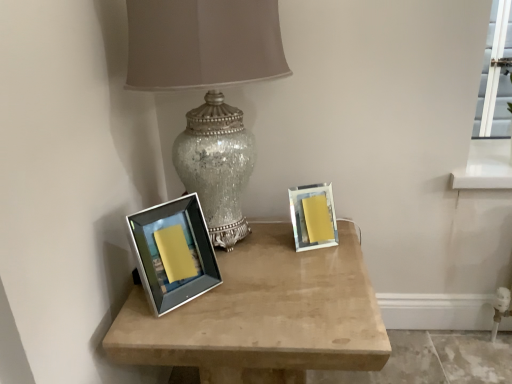
Question: Can we say matte silver picture frame at right, the first picture frame viewed from the back, lies outside crackle glass lamp at center?

Choices:
 (A) yes
 (B) no

Answer: (A)

Question: From a real-world perspective, is matte silver picture frame at right, the first picture frame viewed from the back, positioned under crackle glass lamp at center based on gravity?

Choices:
 (A) no
 (B) yes

Answer: (B)

Question: Does matte silver picture frame at right, which appears as the 2th picture frame when viewed from the left, have a greater width compared to crackle glass lamp at center?

Choices:
 (A) yes
 (B) no

Answer: (B)

Question: Is matte silver picture frame at right, the first picture frame viewed from the back, looking in the opposite direction of crackle glass lamp at center?

Choices:
 (A) no
 (B) yes

Answer: (A)

Question: Is the depth of matte silver picture frame at right, which appears as the 2th picture frame when viewed from the left, greater than that of crackle glass lamp at center?

Choices:
 (A) yes
 (B) no

Answer: (A)

Question: Is matte silver picture frame at right, the 2th picture frame when ordered from front to back, thinner than crackle glass lamp at center?

Choices:
 (A) no
 (B) yes

Answer: (B)

Question: Considering the relative sizes of satin silver frame at center and matte silver picture frame at right, which appears as the 2th picture frame when viewed from the left, in the image provided, is satin silver frame at center smaller than matte silver picture frame at right, which appears as the 2th picture frame when viewed from the left,?

Choices:
 (A) no
 (B) yes

Answer: (A)

Question: From the image's perspective, does satin silver frame at center appear higher than matte silver picture frame at right, positioned as the 1th picture frame in right-to-left order?

Choices:
 (A) yes
 (B) no

Answer: (B)

Question: Does satin silver frame at center have a larger size compared to matte silver picture frame at right, positioned as the 1th picture frame in right-to-left order?

Choices:
 (A) no
 (B) yes

Answer: (B)

Question: Does satin silver frame at center appear on the left side of matte silver picture frame at right, which appears as the 2th picture frame when viewed from the left?

Choices:
 (A) yes
 (B) no

Answer: (A)

Question: Does satin silver frame at center appear on the right side of matte silver picture frame at right, positioned as the 1th picture frame in right-to-left order?

Choices:
 (A) yes
 (B) no

Answer: (B)

Question: Is satin silver frame at center far from matte silver picture frame at right, the first picture frame viewed from the back?

Choices:
 (A) no
 (B) yes

Answer: (A)

Question: Is matte silver picture frame at right, the 2th picture frame when ordered from front to back, touching satin silver frame at center?

Choices:
 (A) no
 (B) yes

Answer: (A)